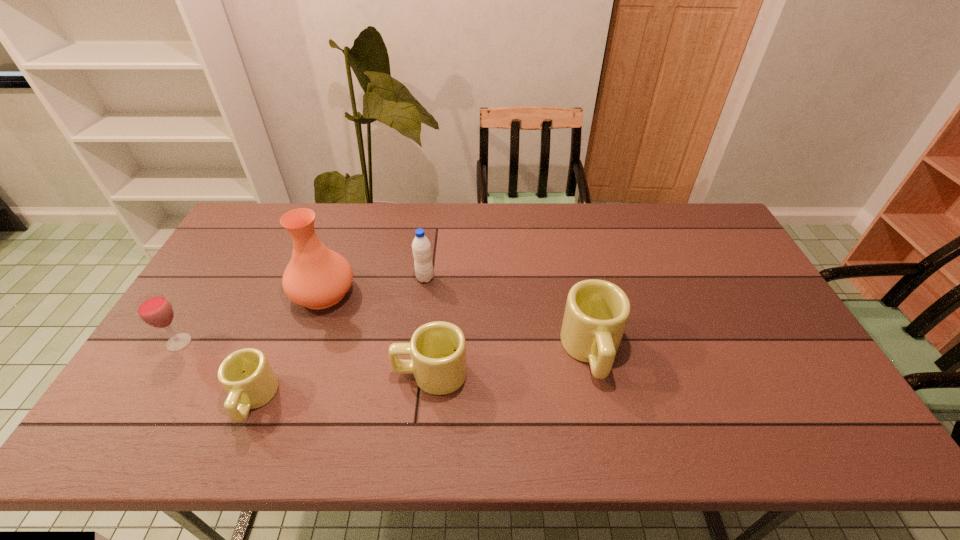
Image resolution: width=960 pixels, height=540 pixels. I want to click on the shortest mug, so click(246, 375).

Locate an element on the screen. The image size is (960, 540). the leftmost mug is located at coordinates (246, 375).

The width and height of the screenshot is (960, 540). Identify the location of the second shortest mug. (438, 349).

Where is `the second shortest object`? the second shortest object is located at coordinates (438, 349).

Locate an element on the screen. The height and width of the screenshot is (540, 960). the tallest mug is located at coordinates (596, 314).

You are a GUI agent. You are given a task and a screenshot of the screen. Output one action in this format:
    pyautogui.click(x=<x>, y=<y>)
    Task: Click on the rightmost object
    The width and height of the screenshot is (960, 540).
    Given the screenshot: What is the action you would take?
    pyautogui.click(x=596, y=314)

In order to click on wineglass in this screenshot , I will do `click(155, 310)`.

Identify the location of vase. (316, 277).

Where is `water bottle`? water bottle is located at coordinates (421, 247).

Locate an element on the screen. The height and width of the screenshot is (540, 960). vacant space located 0.200m with the handle on the side of the second tallest mug is located at coordinates (315, 374).